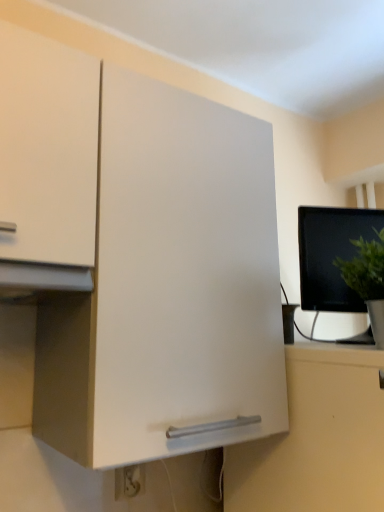
Question: Is black glossy monitor at right closer to camera compared to green matte plant at right?

Choices:
 (A) no
 (B) yes

Answer: (A)

Question: Does black glossy monitor at right lie behind green matte plant at right?

Choices:
 (A) yes
 (B) no

Answer: (A)

Question: Can you confirm if black glossy monitor at right is bigger than green matte plant at right?

Choices:
 (A) yes
 (B) no

Answer: (A)

Question: Is green matte plant at right completely or partially inside black glossy monitor at right?

Choices:
 (A) no
 (B) yes

Answer: (A)

Question: Is black glossy monitor at right oriented away from green matte plant at right?

Choices:
 (A) no
 (B) yes

Answer: (A)

Question: Are black glossy monitor at right and green matte plant at right located far from each other?

Choices:
 (A) no
 (B) yes

Answer: (A)

Question: From the image's perspective, is white plastic electric outlet at lower center on black glossy monitor at right?

Choices:
 (A) yes
 (B) no

Answer: (B)

Question: Is white plastic electric outlet at lower center smaller than black glossy monitor at right?

Choices:
 (A) no
 (B) yes

Answer: (B)

Question: Can you see white plastic electric outlet at lower center touching black glossy monitor at right?

Choices:
 (A) yes
 (B) no

Answer: (B)

Question: Is white plastic electric outlet at lower center looking in the opposite direction of black glossy monitor at right?

Choices:
 (A) no
 (B) yes

Answer: (A)

Question: Considering the relative sizes of white plastic electric outlet at lower center and black glossy monitor at right in the image provided, is white plastic electric outlet at lower center taller than black glossy monitor at right?

Choices:
 (A) no
 (B) yes

Answer: (A)

Question: Considering the relative sizes of white plastic electric outlet at lower center and black glossy monitor at right in the image provided, is white plastic electric outlet at lower center wider than black glossy monitor at right?

Choices:
 (A) yes
 (B) no

Answer: (B)

Question: Does green matte plant at right come in front of white plastic electric outlet at lower center?

Choices:
 (A) yes
 (B) no

Answer: (A)